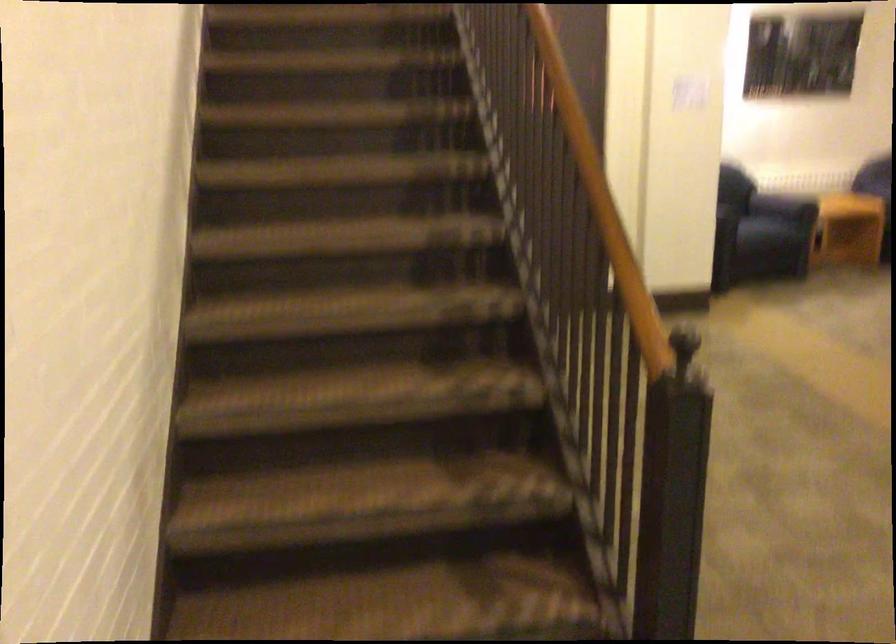
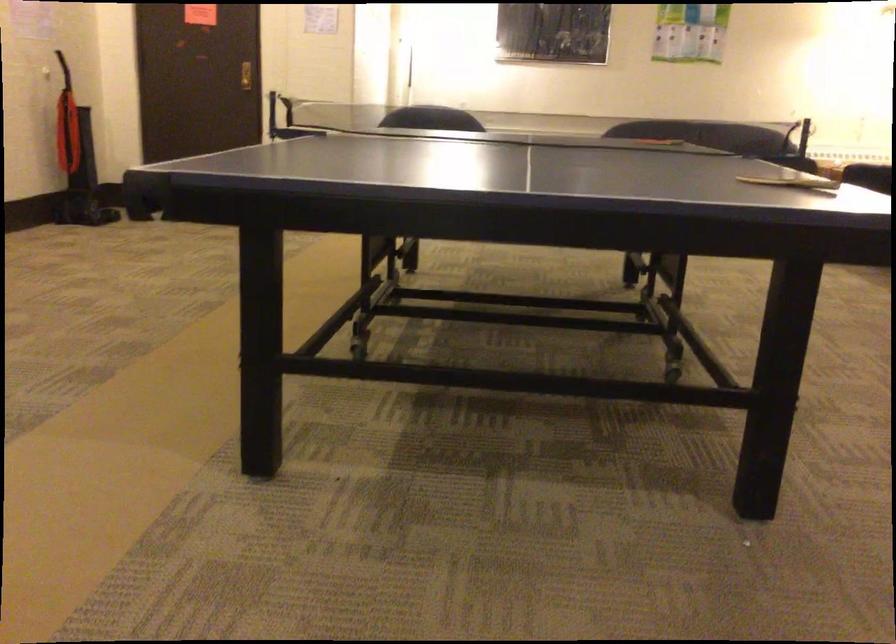
Question: Which direction would the cameraman need to move to produce the second image? Reply with the corresponding letter.

Choices:
 (A) Left
 (B) Right
 (C) Forward
 (D) Backward

Answer: (B)